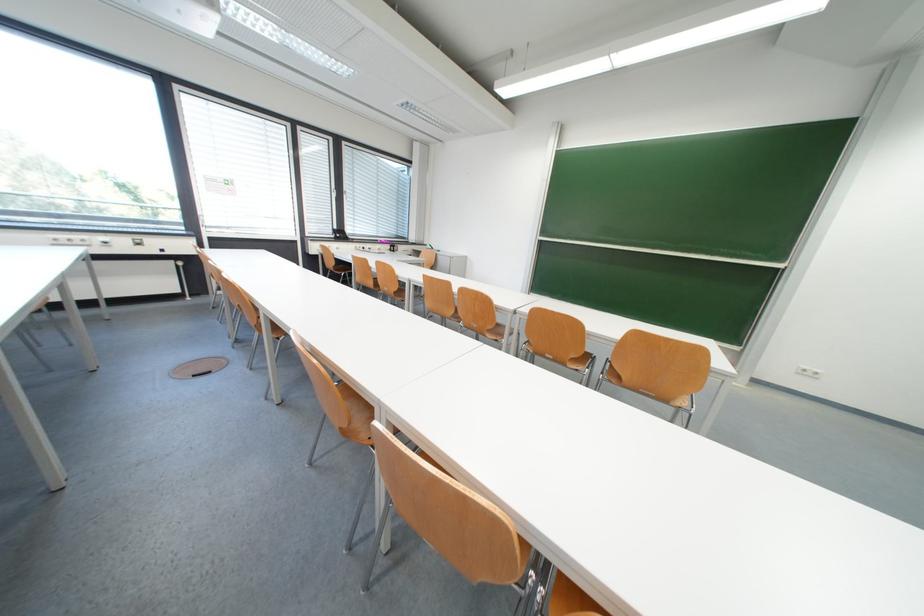
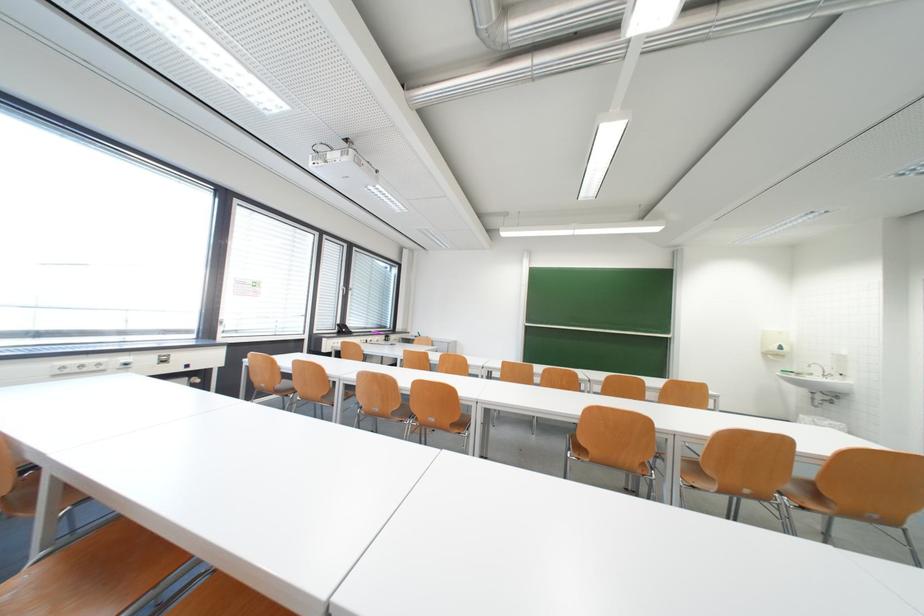
Question: The images are taken continuously from a first-person perspective. In which direction are you moving?

Choices:
 (A) Left
 (B) Right
 (C) Forward
 (D) Backward

Answer: (A)